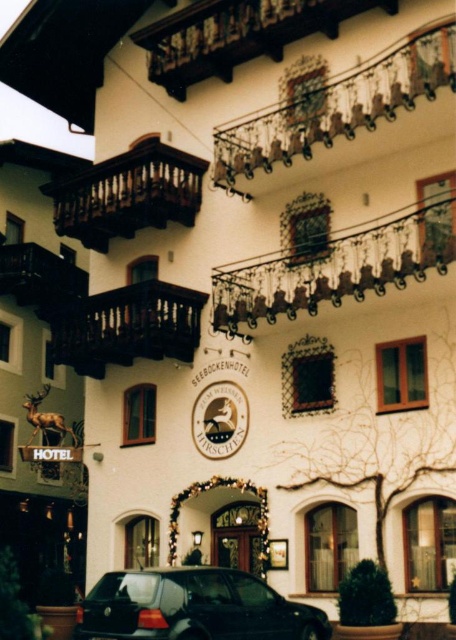
Question: Which point is farther to the camera?

Choices:
 (A) (221, 134)
 (B) (207, 22)
 (C) (198, 422)

Answer: (B)

Question: Which of the following is the closest to the observer?

Choices:
 (A) (125, 230)
 (B) (384, 76)
 (C) (232, 618)
 (D) (93, 305)

Answer: (C)

Question: Is wooden balcony at upper center to the left of brown wooden balcony at upper center from the viewer's perspective?

Choices:
 (A) yes
 (B) no

Answer: (B)

Question: Considering the real-world distances, which object is closest to the polished wrought iron balcony at center?

Choices:
 (A) gold metallic clock at center
 (B) wooden railing at upper center
 (C) wooden balcony at upper center
 (D) shiny black car at lower center

Answer: (B)

Question: Is shiny black car at lower center further to camera compared to gold metallic clock at center?

Choices:
 (A) yes
 (B) no

Answer: (B)

Question: Is wooden railing at upper center closer to the viewer compared to wooden balcony at left?

Choices:
 (A) no
 (B) yes

Answer: (B)